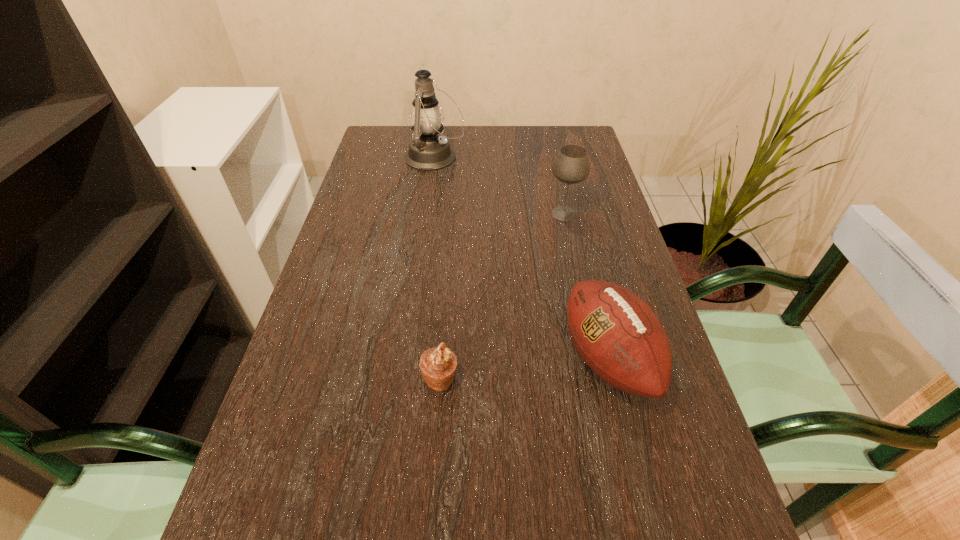
Where is `vacant area between the wineglass and the shortest object`? The image size is (960, 540). vacant area between the wineglass and the shortest object is located at coordinates (502, 296).

Locate an element on the screen. The height and width of the screenshot is (540, 960). free space between the muffin and the wineglass is located at coordinates (502, 296).

Locate an element on the screen. The height and width of the screenshot is (540, 960). free area in between the shortest object and the second tallest object is located at coordinates (502, 296).

I want to click on vacant region between the football (American) and the oil lamp, so click(521, 258).

The image size is (960, 540). I want to click on free space between the muffin and the second tallest object, so click(502, 296).

Locate an element on the screen. vacant space that is in between the shortest object and the second shortest object is located at coordinates (524, 369).

Locate an element on the screen. object that stands as the third closest to the muffin is located at coordinates (428, 151).

Locate an element on the screen. The width and height of the screenshot is (960, 540). object that is the nearest to the wineglass is located at coordinates (428, 151).

Locate an element on the screen. This screenshot has height=540, width=960. free space that satisfies the following two spatial constraints: 1. on the back side of the wineglass; 2. on the right side of the muffin is located at coordinates (452, 213).

You are a GUI agent. You are given a task and a screenshot of the screen. Output one action in this format:
    pyautogui.click(x=<x>, y=<y>)
    Task: Click on the vacant region that satisfies the following two spatial constraints: 1. on the front side of the farthest object; 2. on the right side of the wineglass
    
    Given the screenshot: What is the action you would take?
    pyautogui.click(x=426, y=213)